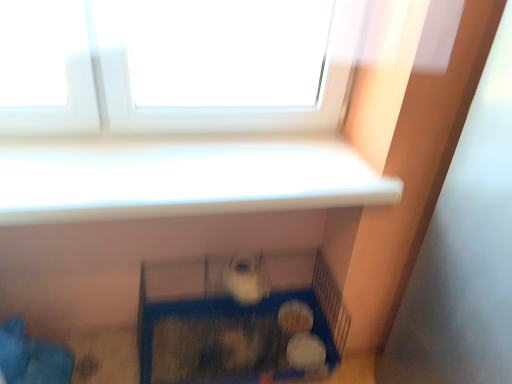
Question: Should I look upward or downward to see blue plastic cage at lower center?

Choices:
 (A) down
 (B) up

Answer: (A)

Question: Does white fluffy ball at lower center, placed as the first animal when sorted from bottom to top, have a greater width compared to white fluffy ball at lower center, which is counted as the 3th animal, starting from the front?

Choices:
 (A) no
 (B) yes

Answer: (A)

Question: Is white fluffy ball at lower center, positioned as the second animal in front-to-back order, positioned behind white fluffy ball at lower center, which ranks as the second animal in top-to-bottom order?

Choices:
 (A) no
 (B) yes

Answer: (A)

Question: From a real-world perspective, is white fluffy ball at lower center, positioned as the second animal in front-to-back order, below white fluffy ball at lower center, which ranks as the second animal in top-to-bottom order?

Choices:
 (A) no
 (B) yes

Answer: (B)

Question: Is white fluffy ball at lower center, positioned as the second animal in front-to-back order, positioned far away from white fluffy ball at lower center, which ranks as the second animal in top-to-bottom order?

Choices:
 (A) no
 (B) yes

Answer: (A)

Question: Are white fluffy ball at lower center, positioned as the second animal in front-to-back order, and white fluffy ball at lower center, the first animal in the back-to-front sequence, beside each other?

Choices:
 (A) yes
 (B) no

Answer: (A)

Question: Is white fluffy ball at lower center, marked as the 2th animal in a back-to-front arrangement, taller than white fluffy ball at lower center, which is counted as the 3th animal, starting from the front?

Choices:
 (A) yes
 (B) no

Answer: (B)

Question: Does white fluffy ball at lower center, which ranks as the second animal in top-to-bottom order, have a greater width compared to white fur at center, the 1th animal viewed from the top?

Choices:
 (A) yes
 (B) no

Answer: (B)

Question: Can you confirm if white fluffy ball at lower center, which appears as the 2th animal when ordered from the bottom, is positioned to the left of white fur at center, positioned as the 3th animal in bottom-to-top order?

Choices:
 (A) yes
 (B) no

Answer: (B)

Question: Is white fluffy ball at lower center, the first animal in the back-to-front sequence, turned away from white fur at center, which is the third animal in back-to-front order?

Choices:
 (A) yes
 (B) no

Answer: (B)

Question: Considering the relative positions of white fluffy ball at lower center, which is counted as the 3th animal, starting from the front, and white fur at center, the 1th animal viewed from the top, in the image provided, is white fluffy ball at lower center, which is counted as the 3th animal, starting from the front, to the right of white fur at center, the 1th animal viewed from the top, from the viewer's perspective?

Choices:
 (A) yes
 (B) no

Answer: (A)

Question: Is white fluffy ball at lower center, the first animal in the back-to-front sequence, closer to the viewer compared to white fur at center, placed as the 1th animal when sorted from front to back?

Choices:
 (A) yes
 (B) no

Answer: (B)

Question: From a real-world perspective, is white fluffy ball at lower center, which ranks as the second animal in top-to-bottom order, positioned over white fur at center, which is the third animal in back-to-front order, based on gravity?

Choices:
 (A) yes
 (B) no

Answer: (B)

Question: Is white fur at center, placed as the 1th animal when sorted from front to back, completely or partially outside of blue plastic cage at lower center?

Choices:
 (A) yes
 (B) no

Answer: (A)